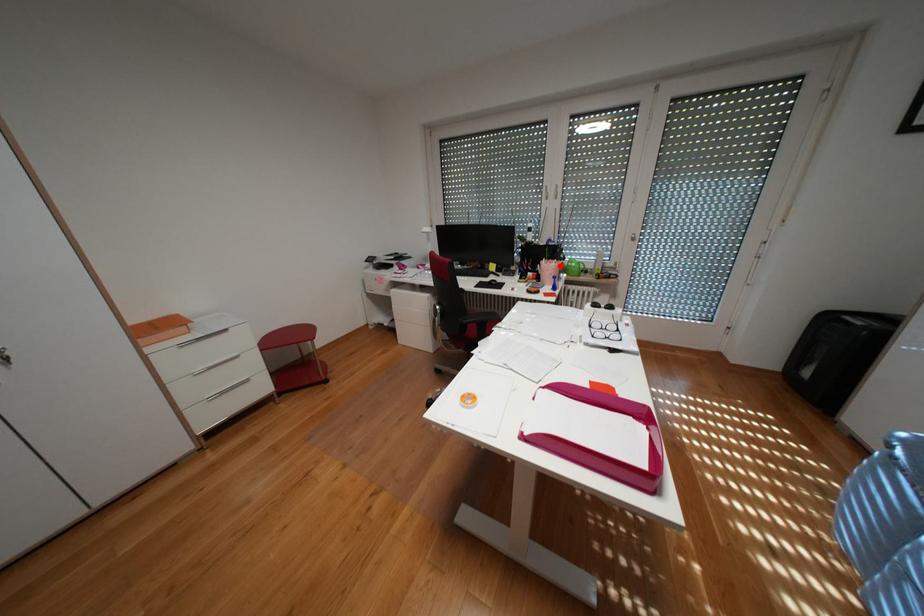
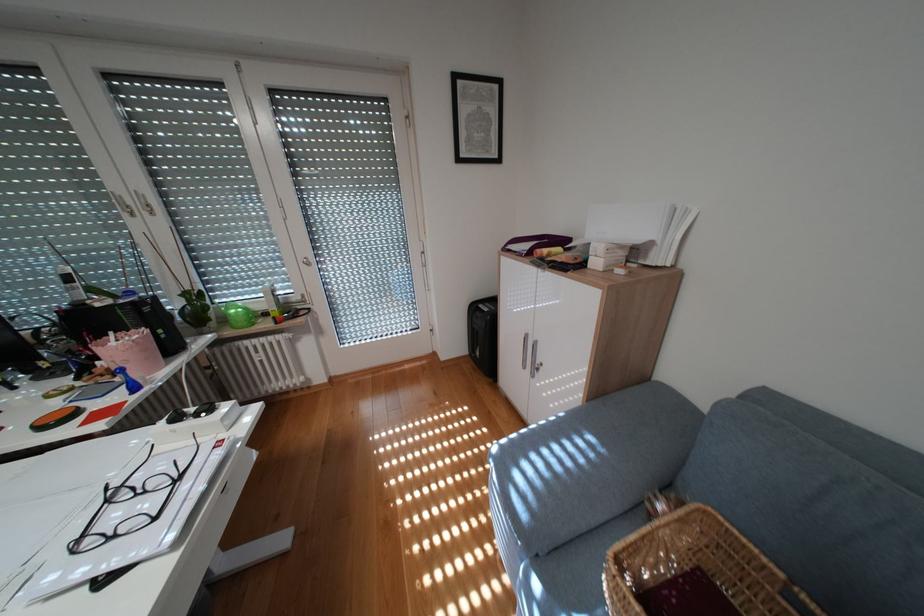
Find the pixel in the second image that matches the highlighted location in the first image.

(136, 345)